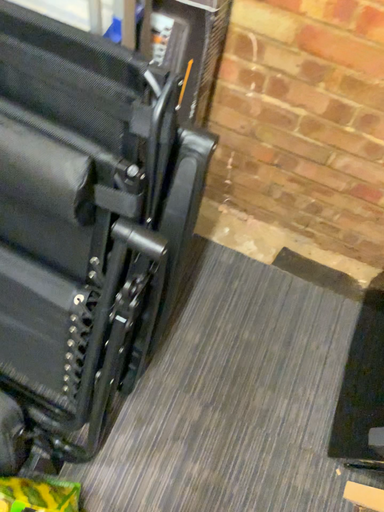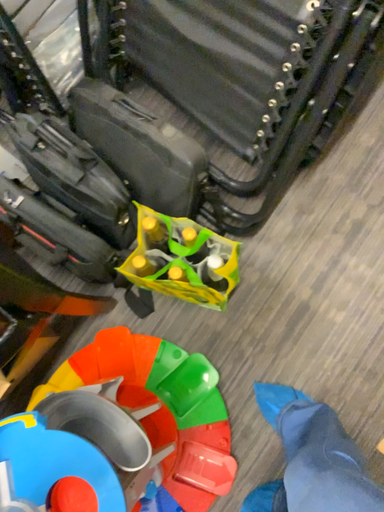
Question: How did the camera likely rotate when shooting the video?

Choices:
 (A) rotated downward
 (B) rotated upward

Answer: (A)